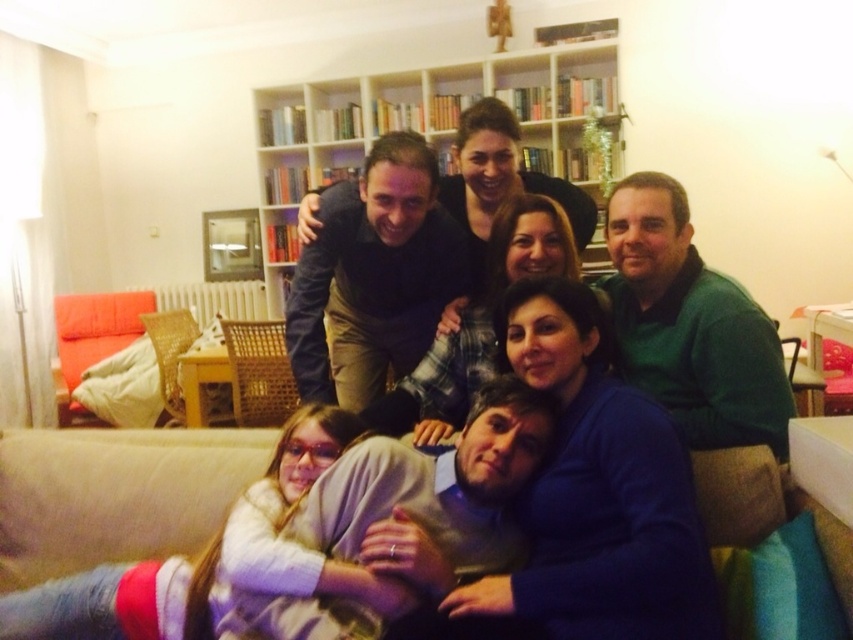
You are standing in the living room and want to place a small decorative item between the two points, point (1, 440) and point (341, 113). Which point should the item be closer to in order to be visible from where you are standing?

The item should be placed closer to point (1, 440) because it is closer to the viewer than point (341, 113).

You are a guest entering the living room and want to sit down on the beige fabric couch at lower center. To avoid bumping into the wooden bookshelf at upper center, which direction should you move relative to the couch?

The beige fabric couch at lower center is located below the wooden bookshelf at upper center. To sit on the couch without hitting the bookshelf, move toward the lower area away from the bookshelf.

You are standing at the entrance of the living room and want to sit on the beige fabric couch at lower center. According to the coordinates provided, in which direction should you move relative to your current position?

The beige fabric couch at lower center is located at coordinates point (x=115, y=493). Since the y coordinate is 0.136, which is closer to the bottom of the image, you should move downward towards the lower part of the room to reach it.